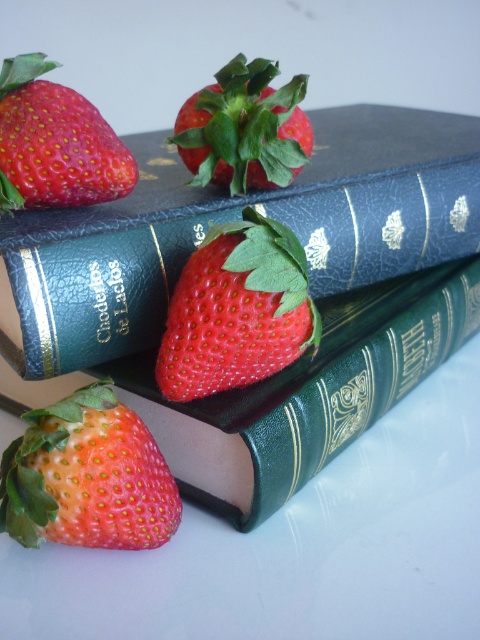
Question: Is green leather book at center positioned at the back of shiny red strawberry at upper left?

Choices:
 (A) yes
 (B) no

Answer: (B)

Question: Among these points, which one is farthest from the camera?

Choices:
 (A) (81, 106)
 (B) (54, 230)
 (C) (222, 106)

Answer: (C)

Question: Which of the following is the farthest from the observer?

Choices:
 (A) (369, 122)
 (B) (94, 381)

Answer: (A)

Question: Does green leather book at center have a lesser width compared to shiny red strawberry at lower left?

Choices:
 (A) no
 (B) yes

Answer: (A)

Question: Can you confirm if green leather book at center is bigger than glossy red strawberry at center?

Choices:
 (A) no
 (B) yes

Answer: (B)

Question: Which object is farther from the camera taking this photo?

Choices:
 (A) shiny red strawberry at lower left
 (B) green leather book at center
 (C) green leather book at upper center
 (D) shiny red strawberry at center

Answer: (B)